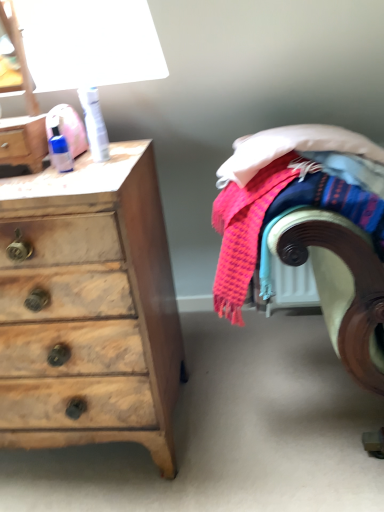
This screenshot has height=512, width=384. What are the coordinates of `vacant space in front of blue plastic bottle at upper left, marked as the 1th toiletry in a left-to-right arrangement` in the screenshot? It's located at (66, 182).